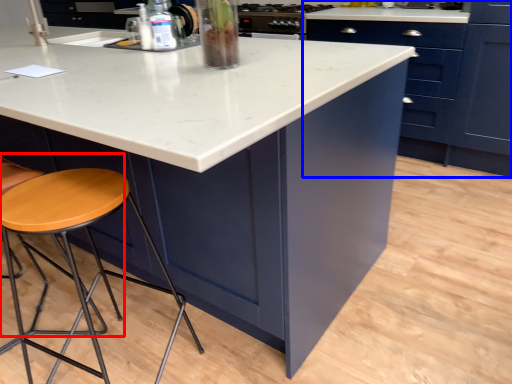
Question: Which of the following is the closest to the observer, chair (highlighted by a red box) or cabinetry (highlighted by a blue box)?

Choices:
 (A) chair
 (B) cabinetry

Answer: (A)